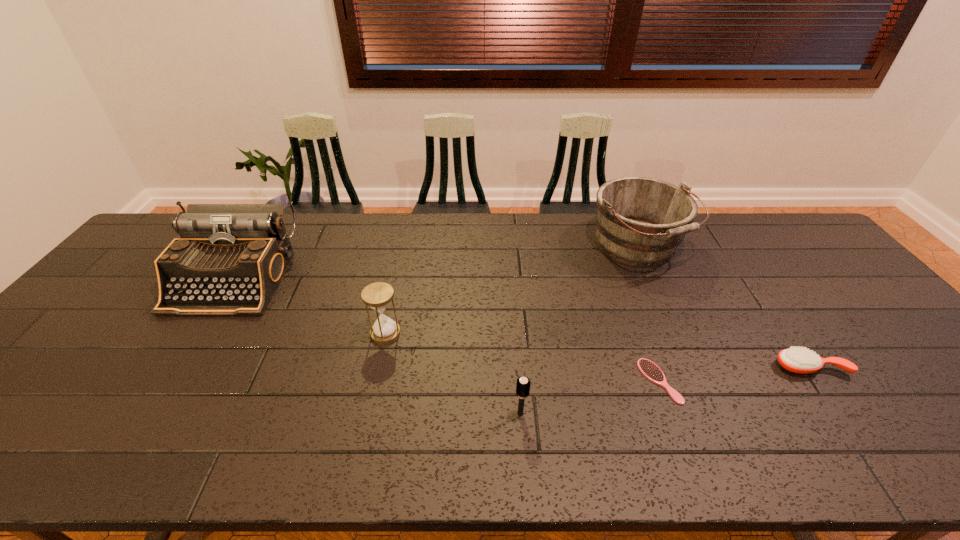
The height and width of the screenshot is (540, 960). In order to click on free spot between the rightmost hairbrush and the wine bucket in this screenshot , I will do `click(724, 306)`.

You are a GUI agent. You are given a task and a screenshot of the screen. Output one action in this format:
    pyautogui.click(x=<x>, y=<y>)
    Task: Click on the empty location between the wine bucket and the shortest object
    Image resolution: width=960 pixels, height=540 pixels.
    Given the screenshot: What is the action you would take?
    pyautogui.click(x=649, y=314)

Where is `object identified as the fifth closest to the wine bucket`? The height and width of the screenshot is (540, 960). object identified as the fifth closest to the wine bucket is located at coordinates (229, 259).

The height and width of the screenshot is (540, 960). What are the coordinates of `object that is the third closest to the typewriter` in the screenshot? It's located at (640, 221).

Find the location of a particular element. This screenshot has height=540, width=960. the closest hairbrush to the fifth tallest object is located at coordinates (650, 370).

At what (x,y) coordinates should I click in order to perform the action: click on hairbrush identified as the second closest to the fourth nearest object. Please return your answer as a coordinate pair (x, y). This screenshot has width=960, height=540. Looking at the image, I should click on (650, 370).

Where is `free point that satisfies the following two spatial constraints: 1. on the keyboard of the third farthest object; 2. on the right side of the typewriter`? This screenshot has width=960, height=540. free point that satisfies the following two spatial constraints: 1. on the keyboard of the third farthest object; 2. on the right side of the typewriter is located at coordinates (198, 333).

In order to click on free space that satisfies the following two spatial constraints: 1. on the keyboard of the shortest hairbrush; 2. on the left side of the leftmost object in this screenshot , I will do `click(167, 381)`.

Find the location of `free location that satisfies the following two spatial constraints: 1. on the keyboard of the typewriter; 2. on the left side of the second shortest hairbrush`. free location that satisfies the following two spatial constraints: 1. on the keyboard of the typewriter; 2. on the left side of the second shortest hairbrush is located at coordinates (177, 367).